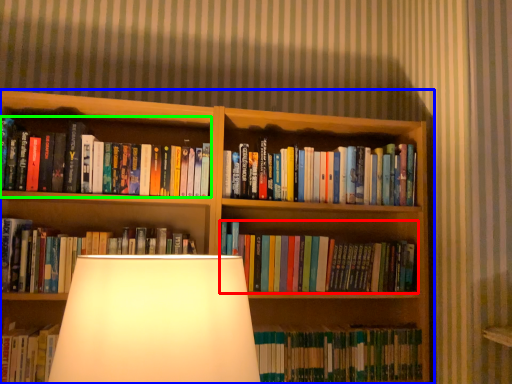
Question: Which object is the closest to the book (highlighted by a red box)? Choose among these: bookcase (highlighted by a blue box) or book (highlighted by a green box).

Choices:
 (A) bookcase
 (B) book

Answer: (A)